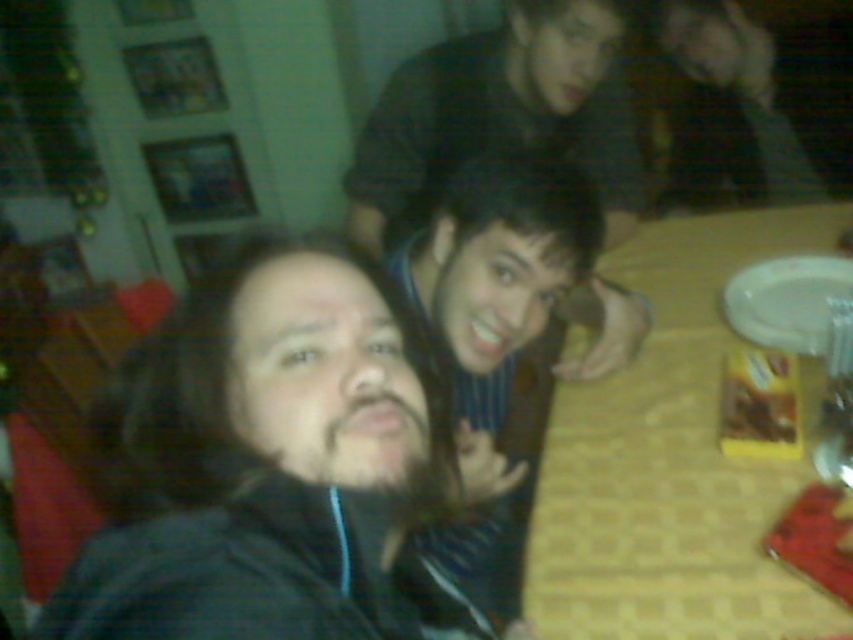
Between yellow fabric table at lower right and white glossy plate at right, which one is positioned lower?

yellow fabric table at lower right is lower down.

Is point (657, 412) less distant than point (788, 326)?

Yes, it is in front of point (788, 326).

Between point (544, 497) and point (833, 301), which one is positioned behind?

Point (833, 301)

This screenshot has height=640, width=853. In order to click on yellow fabric table at lower right in this screenshot , I will do `click(672, 461)`.

Between point (178, 570) and point (831, 328), which one is positioned behind?

Point (831, 328)

Between point (254, 600) and point (775, 282), which one is positioned in front?

Point (254, 600) is in front.

Locate an element on the screen. This screenshot has height=640, width=853. matte black hair at center is located at coordinates (271, 465).

Is matte black hair at center to the right of shiny blue shirt at center from the viewer's perspective?

In fact, matte black hair at center is to the left of shiny blue shirt at center.

Is matte black hair at center shorter than shiny blue shirt at center?

Indeed, matte black hair at center has a lesser height compared to shiny blue shirt at center.

At what (x,y) coordinates should I click in order to perform the action: click on matte black hair at center. Please return your answer as a coordinate pair (x, y). This screenshot has height=640, width=853. Looking at the image, I should click on (271, 465).